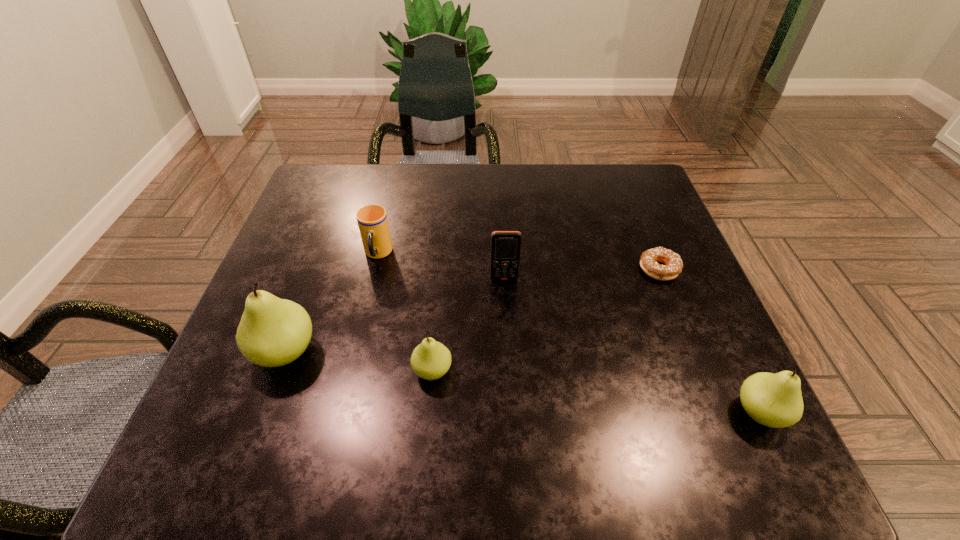
The image size is (960, 540). I want to click on the leftmost object, so click(x=273, y=332).

At what (x,y) coordinates should I click in order to perform the action: click on the leftmost pear. Please return your answer as a coordinate pair (x, y). Looking at the image, I should click on (273, 332).

This screenshot has height=540, width=960. Identify the location of the second pear from left to right. (430, 360).

Locate an element on the screen. the third object from left to right is located at coordinates (430, 360).

At what (x,y) coordinates should I click in order to perform the action: click on the second shortest pear. Please return your answer as a coordinate pair (x, y). The image size is (960, 540). Looking at the image, I should click on (775, 400).

Identify the location of the fourth object from left to right. (505, 245).

Where is `the fifth object from right to left`? The image size is (960, 540). the fifth object from right to left is located at coordinates (372, 221).

Locate an element on the screen. This screenshot has height=540, width=960. the shortest object is located at coordinates (673, 266).

Where is `blank area located on the back of the tallest object`? blank area located on the back of the tallest object is located at coordinates (303, 303).

Locate an element on the screen. vacant area situated on the right of the second pear from right to left is located at coordinates pyautogui.click(x=569, y=370).